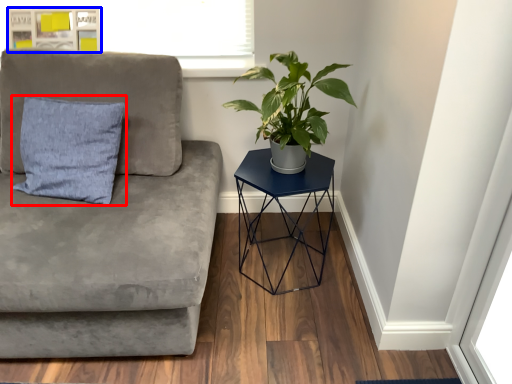
Question: Among these objects, which one is farthest to the camera, pillow (highlighted by a red box) or bulletin board (highlighted by a blue box)?

Choices:
 (A) pillow
 (B) bulletin board

Answer: (B)